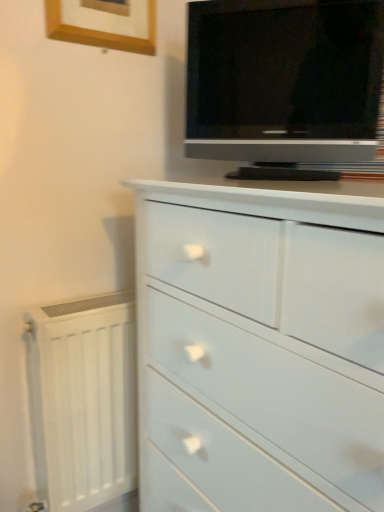
Question: Considering their positions, is matte black tv at upper right located in front of or behind white painted radiator at lower left?

Choices:
 (A) front
 (B) behind

Answer: (A)

Question: Is point (324, 90) positioned closer to the camera than point (125, 376)?

Choices:
 (A) closer
 (B) farther

Answer: (A)

Question: Which object is the closest to the white glossy chest of drawers at center?

Choices:
 (A) white painted radiator at lower left
 (B) matte black tv at upper right
 (C) wooden picture frame at upper left

Answer: (A)

Question: Estimate the real-world distances between objects in this image. Which object is farther from the wooden picture frame at upper left?

Choices:
 (A) white painted radiator at lower left
 (B) matte black tv at upper right
 (C) white glossy chest of drawers at center

Answer: (A)